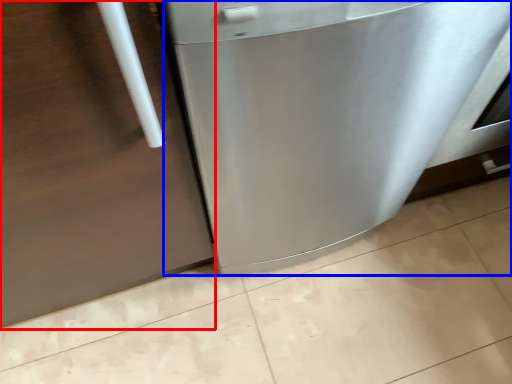
Question: Which of the following is the farthest to the observer, door (highlighted by a red box) or home appliance (highlighted by a blue box)?

Choices:
 (A) door
 (B) home appliance

Answer: (B)